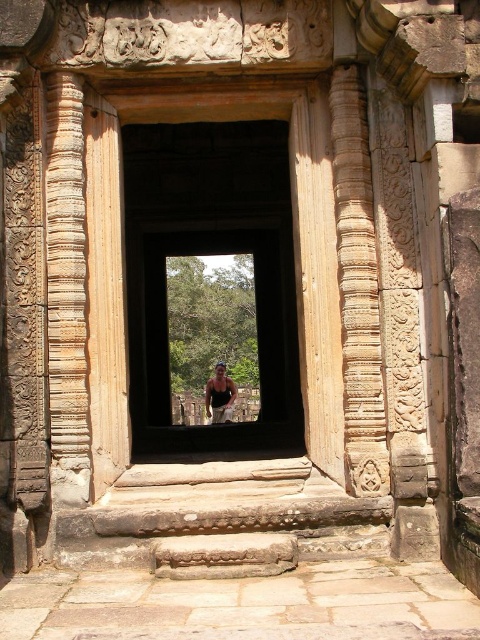
Who is positioned more to the left, brown stone door at center or matte black tank top at center?

From the viewer's perspective, matte black tank top at center appears more on the left side.

In the scene shown: Does brown stone door at center lie behind matte black tank top at center?

No, it is in front of matte black tank top at center.

I want to click on brown stone door at center, so click(292, 234).